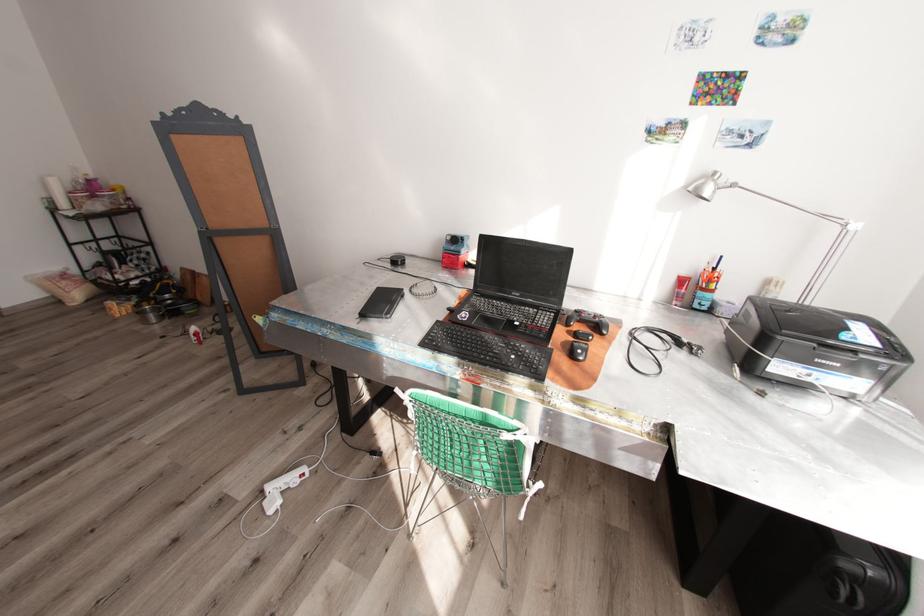
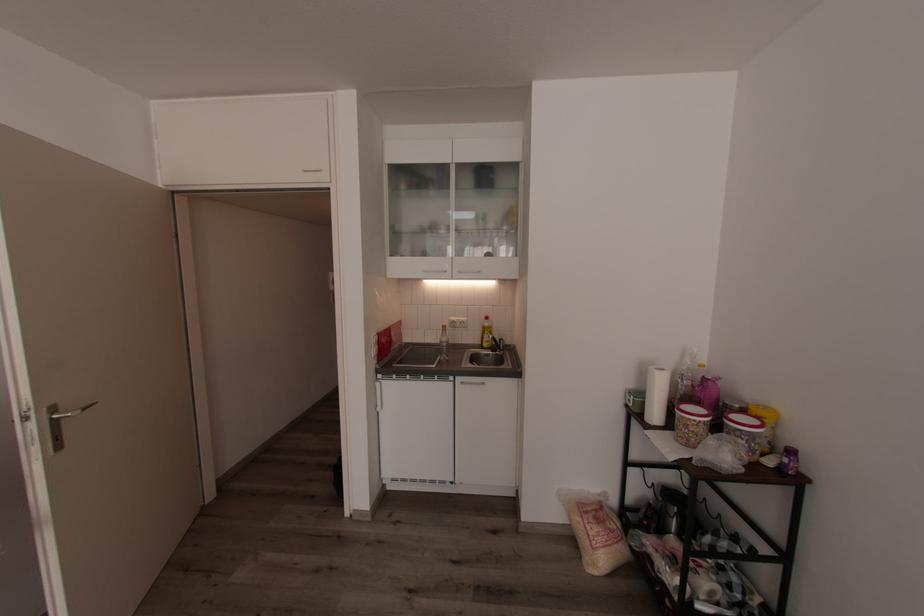
The point at (67,285) is marked in the first image. Where is the corresponding point in the second image?

(594, 533)